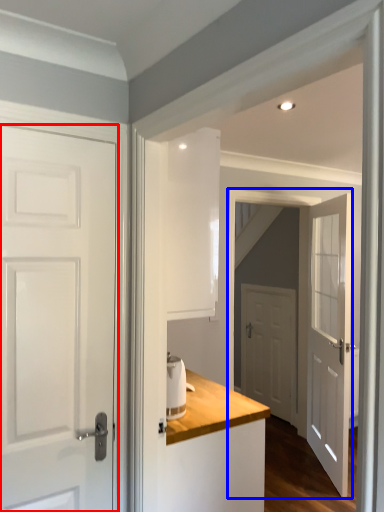
Question: Which of the following is the closest to the observer, door (highlighted by a red box) or screen door (highlighted by a blue box)?

Choices:
 (A) door
 (B) screen door

Answer: (A)